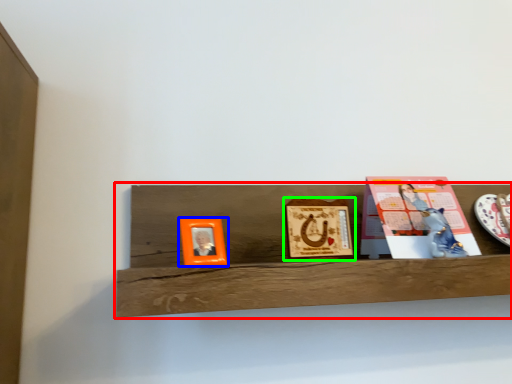
Question: Estimate the real-world distances between objects in this image. Which object is closer to shelf (highlighted by a red box), picture frame (highlighted by a blue box) or picture frame (highlighted by a green box)?

Choices:
 (A) picture frame
 (B) picture frame

Answer: (B)